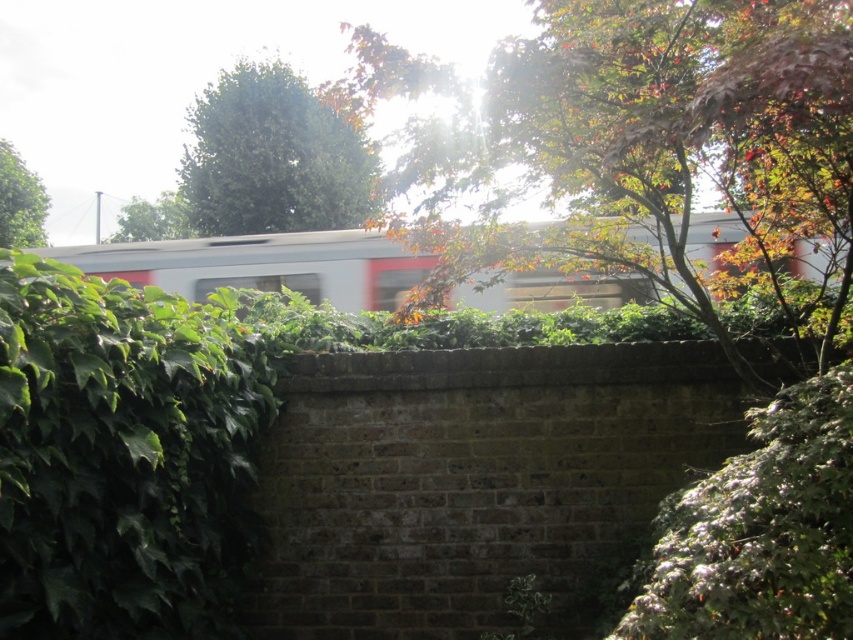
Can you confirm if autumn leaves at upper center is positioned below green leafy tree at left?

No, autumn leaves at upper center is not below green leafy tree at left.

Is the position of autumn leaves at upper center less distant than that of green leafy tree at left?

Yes.

Is point (837, 196) positioned after point (32, 173)?

No.

Find the location of a particular element. This screenshot has width=853, height=640. autumn leaves at upper center is located at coordinates (654, 145).

Is point (387, 288) more distant than point (10, 154)?

No, (387, 288) is in front of (10, 154).

The image size is (853, 640). Describe the element at coordinates (263, 266) in the screenshot. I see `white glossy train at center` at that location.

Does point (506, 289) come in front of point (38, 212)?

Yes, it is.

Find the location of `white glossy train at center`. white glossy train at center is located at coordinates (263, 266).

Which is above, autumn leaves at upper center or green leafy tree at upper center?

green leafy tree at upper center is higher up.

At what (x,y) coordinates should I click in order to perform the action: click on autumn leaves at upper center. Please return your answer as a coordinate pair (x, y). The height and width of the screenshot is (640, 853). Looking at the image, I should click on (654, 145).

Locate an element on the screen. The width and height of the screenshot is (853, 640). autumn leaves at upper center is located at coordinates (654, 145).